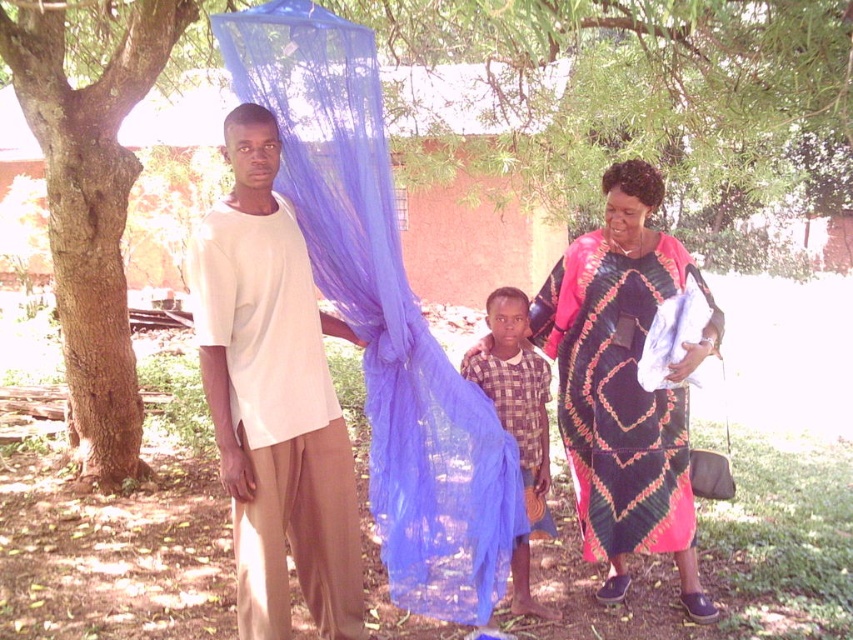
Based on the scene description, which object is smaller in size between the printed cotton dress at center and the brown rough bark tree at left?

The printed cotton dress at center has a smaller size compared to the brown rough bark tree at left.